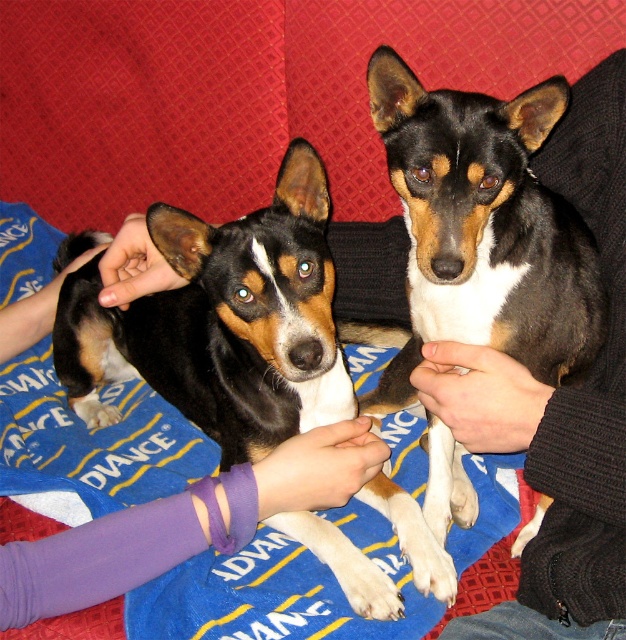
You are trying to locate the black glossy dog at center in the image. According to the coordinates provided, where exactly is it positioned?

The black glossy dog at center is located at point coordinates of (222, 323).

You are a dog trainer observing the scene. You need to check if the purple fabric wristband at lower left is within reach of the black glossy dog at center. Based on their positions, can the dog reach the wristband?

The black glossy dog at center is above the purple fabric wristband at lower left. Since the dog is positioned higher up, it might be able to reach down to the wristband depending on its flexibility and the distance between them. However, without knowing the exact reach capability of the dog, it is uncertain. The description only states their vertical positioning.